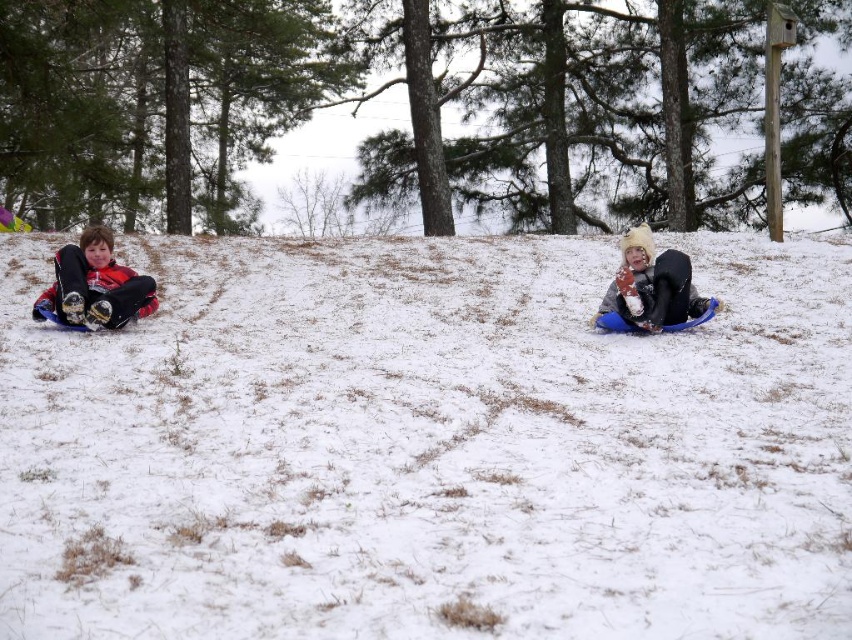
Who is shorter, matte black snowsuit at left or fluffy white snowsuit at center?

matte black snowsuit at left is shorter.

Which is more to the left, matte black snowsuit at left or fluffy white snowsuit at center?

matte black snowsuit at left is more to the left.

Which is behind, point (67, 310) or point (705, 298)?

Point (705, 298)

This screenshot has height=640, width=852. I want to click on matte black snowsuit at left, so click(95, 285).

Does white fluffy snow at center appear under fluffy white snowsuit at center?

Yes, white fluffy snow at center is below fluffy white snowsuit at center.

Between white fluffy snow at center and fluffy white snowsuit at center, which one has more height?

white fluffy snow at center

Is point (769, 348) farther from camera compared to point (619, 294)?

No, it is not.

Image resolution: width=852 pixels, height=640 pixels. I want to click on white fluffy snow at center, so click(427, 445).

Does white fluffy snow at center have a larger size compared to matte black snowsuit at left?

Correct, white fluffy snow at center is larger in size than matte black snowsuit at left.

Can you confirm if white fluffy snow at center is positioned to the left of matte black snowsuit at left?

No, white fluffy snow at center is not to the left of matte black snowsuit at left.

Does point (159, 397) come in front of point (99, 230)?

Yes, it is in front of point (99, 230).

In order to click on white fluffy snow at center in this screenshot , I will do pos(427,445).